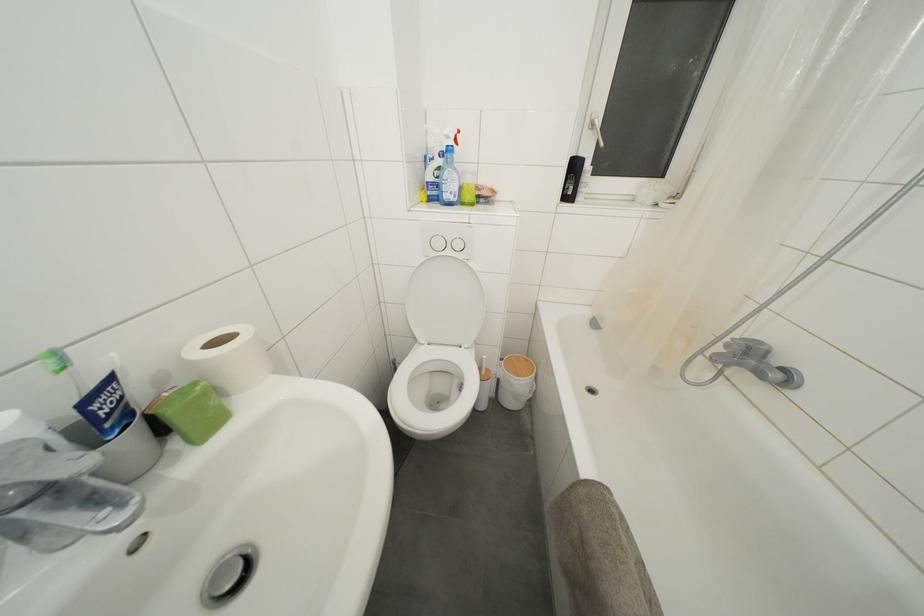
Locate an element on the screen. The width and height of the screenshot is (924, 616). white toilet lid is located at coordinates (445, 312).